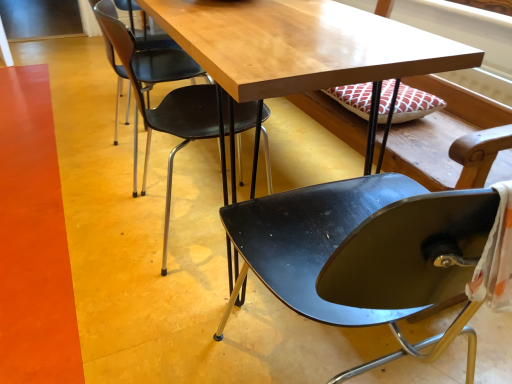
Question: Does wooden table at center turn towards glossy black chair at center, arranged as the 1th chair when viewed from the right?

Choices:
 (A) no
 (B) yes

Answer: (A)

Question: Does wooden table at center have a larger size compared to glossy black chair at center, arranged as the 1th chair when viewed from the right?

Choices:
 (A) no
 (B) yes

Answer: (B)

Question: Can you confirm if wooden table at center is thinner than glossy black chair at center, arranged as the 1th chair when viewed from the right?

Choices:
 (A) no
 (B) yes

Answer: (A)

Question: Does wooden table at center have a greater width compared to glossy black chair at center, which is counted as the 2th chair, starting from the left?

Choices:
 (A) yes
 (B) no

Answer: (A)

Question: Considering the relative positions of wooden table at center and glossy black chair at center, which is counted as the 2th chair, starting from the left, in the image provided, is wooden table at center behind glossy black chair at center, which is counted as the 2th chair, starting from the left,?

Choices:
 (A) yes
 (B) no

Answer: (A)

Question: From the image's perspective, is wooden table at center beneath glossy black chair at center, arranged as the 1th chair when viewed from the right?

Choices:
 (A) no
 (B) yes

Answer: (A)

Question: From a real-world perspective, is glossy black chair at center, which is counted as the 2th chair, starting from the left, over black plastic chair at upper center, which is the 2th chair from right to left?

Choices:
 (A) no
 (B) yes

Answer: (B)

Question: Considering the relative sizes of glossy black chair at center, arranged as the 1th chair when viewed from the right, and black plastic chair at upper center, acting as the 1th chair starting from the left, in the image provided, is glossy black chair at center, arranged as the 1th chair when viewed from the right, wider than black plastic chair at upper center, acting as the 1th chair starting from the left,?

Choices:
 (A) yes
 (B) no

Answer: (A)

Question: Is glossy black chair at center, arranged as the 1th chair when viewed from the right, outside black plastic chair at upper center, acting as the 1th chair starting from the left?

Choices:
 (A) yes
 (B) no

Answer: (A)

Question: Does glossy black chair at center, arranged as the 1th chair when viewed from the right, turn towards black plastic chair at upper center, which is the 2th chair from right to left?

Choices:
 (A) yes
 (B) no

Answer: (A)

Question: Can black plastic chair at upper center, acting as the 1th chair starting from the left, be found inside glossy black chair at center, which is counted as the 2th chair, starting from the left?

Choices:
 (A) yes
 (B) no

Answer: (B)

Question: Does glossy black chair at center, which is counted as the 2th chair, starting from the left, touch black plastic chair at upper center, acting as the 1th chair starting from the left?

Choices:
 (A) yes
 (B) no

Answer: (B)

Question: Does wooden table at center have a greater height compared to black plastic chair at upper center, which is the 2th chair from right to left?

Choices:
 (A) yes
 (B) no

Answer: (A)